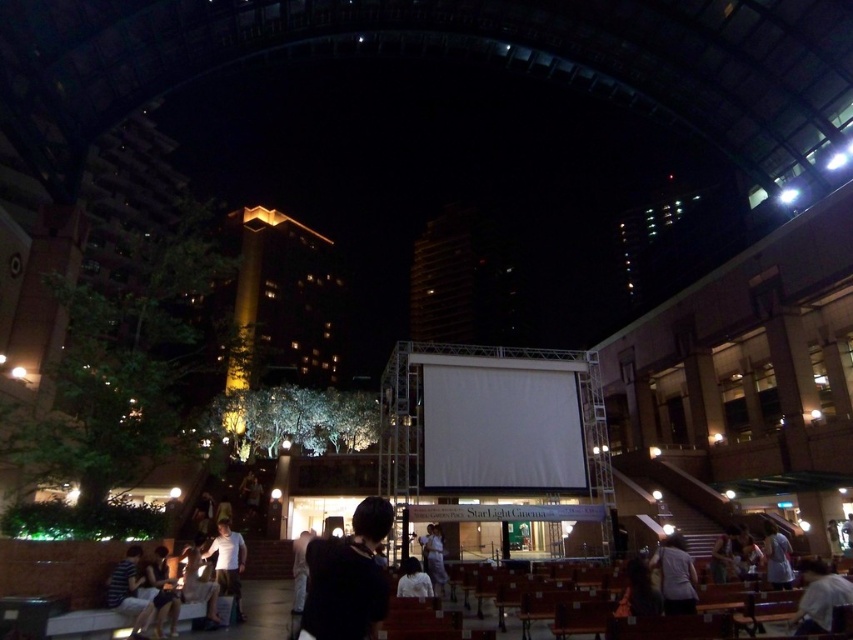
Can you confirm if black matte shirt at center is positioned to the right of light brown fabric shirt at lower right?

No, black matte shirt at center is not to the right of light brown fabric shirt at lower right.

Which is behind, point (357, 544) or point (811, 620)?

The point (811, 620) is behind.

Is point (315, 564) less distant than point (804, 572)?

Yes, it is in front of point (804, 572).

The height and width of the screenshot is (640, 853). I want to click on black matte shirt at center, so click(x=347, y=577).

Does dark gray fabric shirt at center have a larger size compared to light purple fabric at center?

Correct, dark gray fabric shirt at center is larger in size than light purple fabric at center.

Between dark gray fabric shirt at center and light purple fabric at center, which one has less height?

Standing shorter between the two is light purple fabric at center.

Is point (664, 605) farther from camera compared to point (439, 566)?

No, it is not.

This screenshot has width=853, height=640. Identify the location of dark gray fabric shirt at center. (675, 576).

Can you confirm if dark gray fabric shirt at center is thinner than white fabric dress at center?

No, dark gray fabric shirt at center is not thinner than white fabric dress at center.

Is dark gray fabric shirt at center wider than white fabric dress at center?

Yes.

You are a GUI agent. You are given a task and a screenshot of the screen. Output one action in this format:
    pyautogui.click(x=<x>, y=<y>)
    Task: Click on the dark gray fabric shirt at center
    Image resolution: width=853 pixels, height=640 pixels.
    Given the screenshot: What is the action you would take?
    pyautogui.click(x=675, y=576)